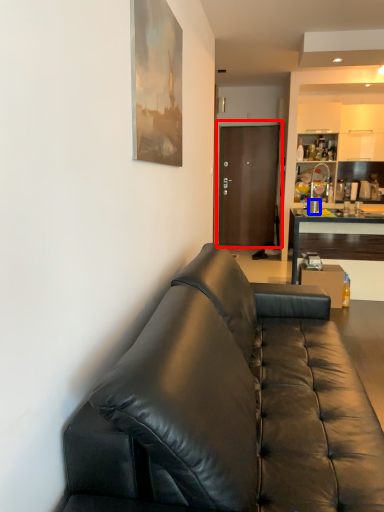
Question: Which object is closer to the camera taking this photo, door (highlighted by a red box) or coffee cup (highlighted by a blue box)?

Choices:
 (A) door
 (B) coffee cup

Answer: (B)